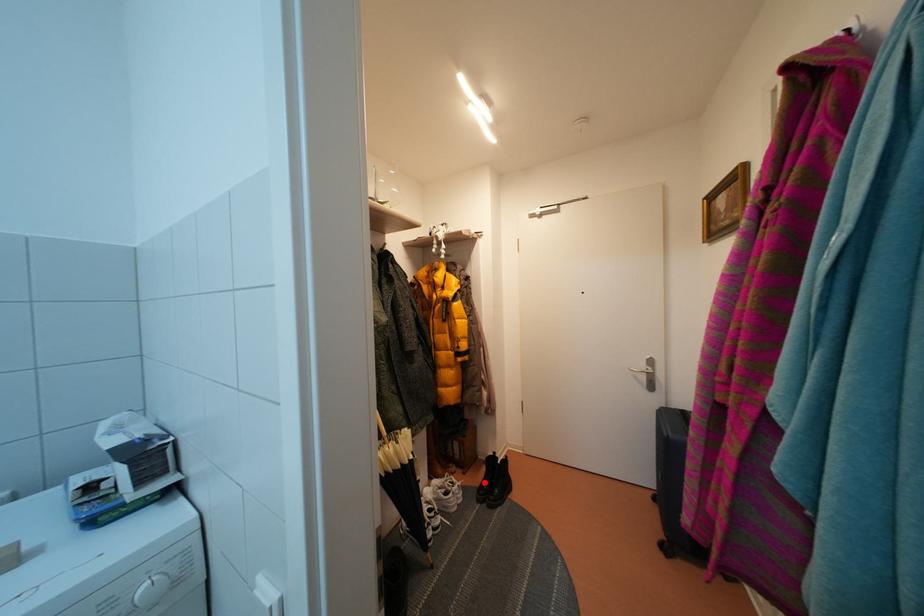
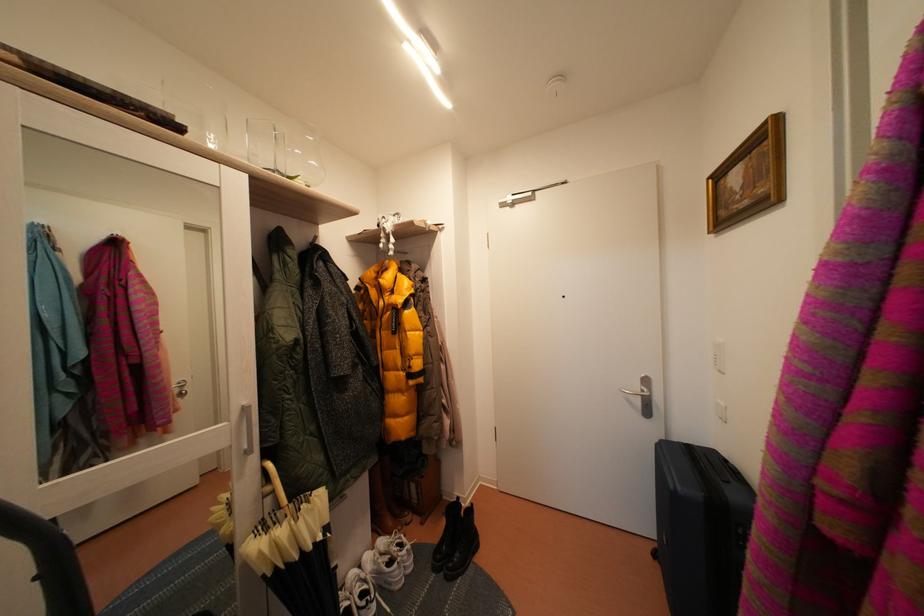
Question: I am providing you with two images of the same scene from different viewpoints. A red point is shown in image1. For the corresponding object point in image2, is it positioned nearer or farther from the camera?

Choices:
 (A) Nearer
 (B) Farther

Answer: (A)